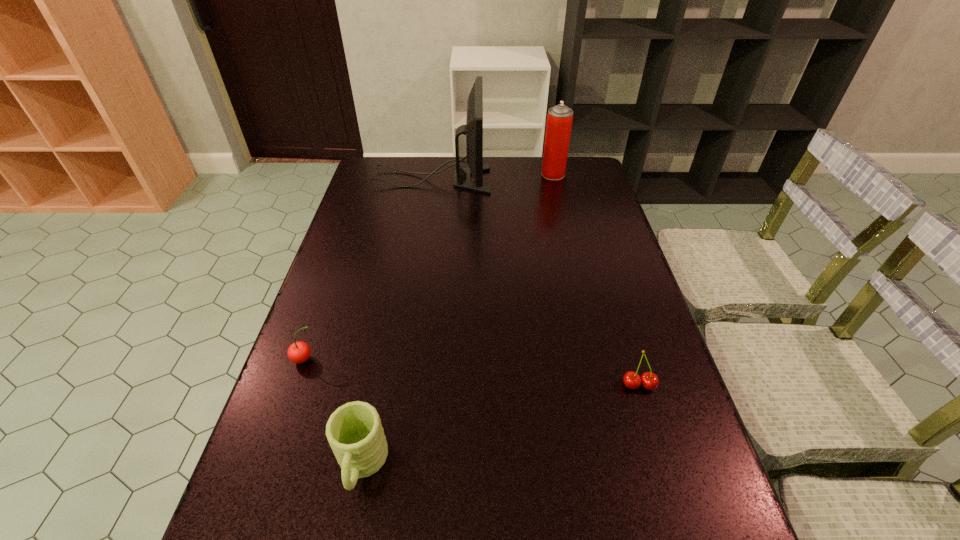
At what (x,y) coordinates should I click in order to perform the action: click on free spot between the right cherry and the mug. Please return your answer as a coordinate pair (x, y). The image size is (960, 540). Looking at the image, I should click on (500, 426).

Locate an element on the screen. Image resolution: width=960 pixels, height=540 pixels. free point between the nearest object and the fourth farthest object is located at coordinates (500, 426).

Where is `empty space that is in between the aerosol can and the right cherry`? Image resolution: width=960 pixels, height=540 pixels. empty space that is in between the aerosol can and the right cherry is located at coordinates (596, 280).

Locate an element on the screen. object that is the second closest to the mug is located at coordinates (649, 380).

This screenshot has height=540, width=960. I want to click on object that is the second closest to the farther cherry, so click(x=473, y=129).

I want to click on vacant space that satisfies the following two spatial constraints: 1. on the screen side of the computer monitor; 2. on the side of the mug with the handle, so pyautogui.click(x=388, y=465).